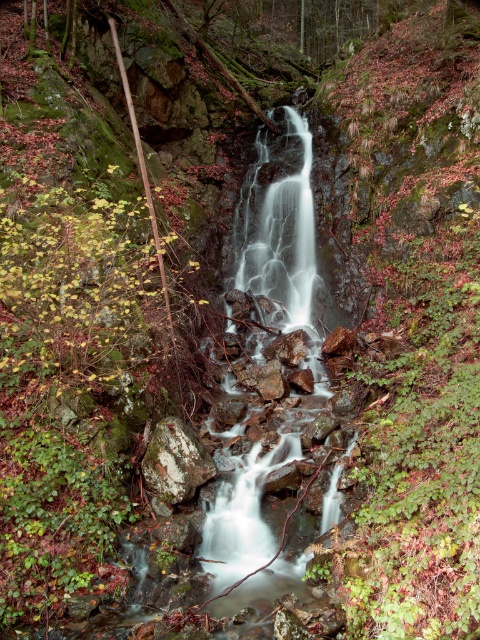
Question: Which object appears closest to the camera in this image?

Choices:
 (A) white smooth water at center
 (B) speckled rock at center

Answer: (A)

Question: Does white smooth water at center appear under speckled rock at center?

Choices:
 (A) yes
 (B) no

Answer: (B)

Question: Can you confirm if white smooth water at center is positioned below speckled rock at center?

Choices:
 (A) no
 (B) yes

Answer: (A)

Question: Can you confirm if white smooth water at center is positioned to the left of speckled rock at center?

Choices:
 (A) yes
 (B) no

Answer: (B)